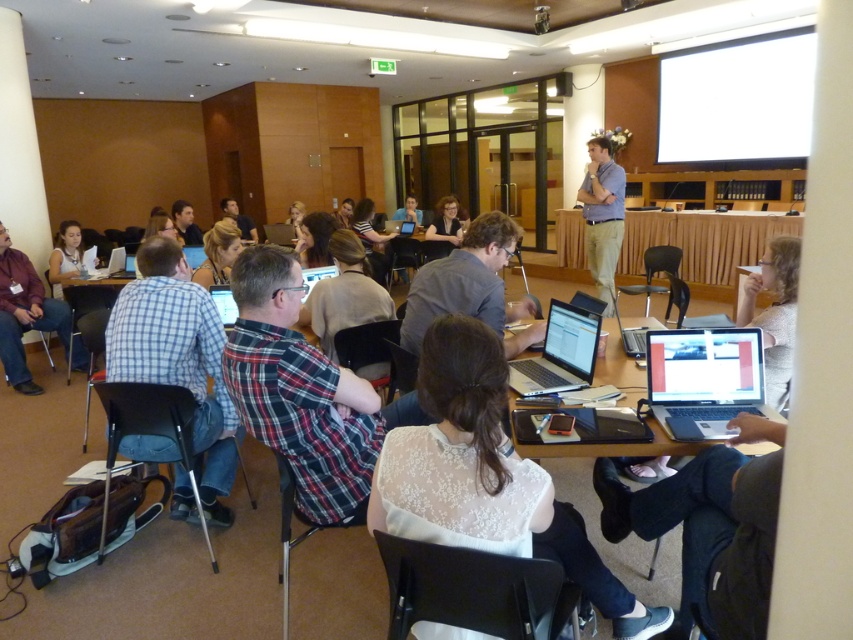
Question: Which is nearer to the white lace blouse at center?

Choices:
 (A) checkered fabric shirt at left
 (B) matte black laptop at center
 (C) silver/black laptop at center

Answer: (C)

Question: Considering the real-world distances, which object is farthest from the matte black laptop at center?

Choices:
 (A) silver metallic laptop at lower right
 (B) white lace blouse at center
 (C) silver/black laptop at center
 (D) matte black shirt at left

Answer: (B)

Question: Is silver metallic laptop at lower right in front of light blue shirt at center?

Choices:
 (A) yes
 (B) no

Answer: (A)

Question: Which of these objects is positioned closest to the silver metallic table at center?

Choices:
 (A) light blue shirt at center
 (B) silver/black laptop at center

Answer: (B)

Question: Can you confirm if white lace blouse at center is positioned to the right of silver metallic table at center?

Choices:
 (A) no
 (B) yes

Answer: (A)

Question: Observing the image, what is the correct spatial positioning of matte black shirt at left in reference to silver metallic table at center?

Choices:
 (A) right
 (B) left

Answer: (B)